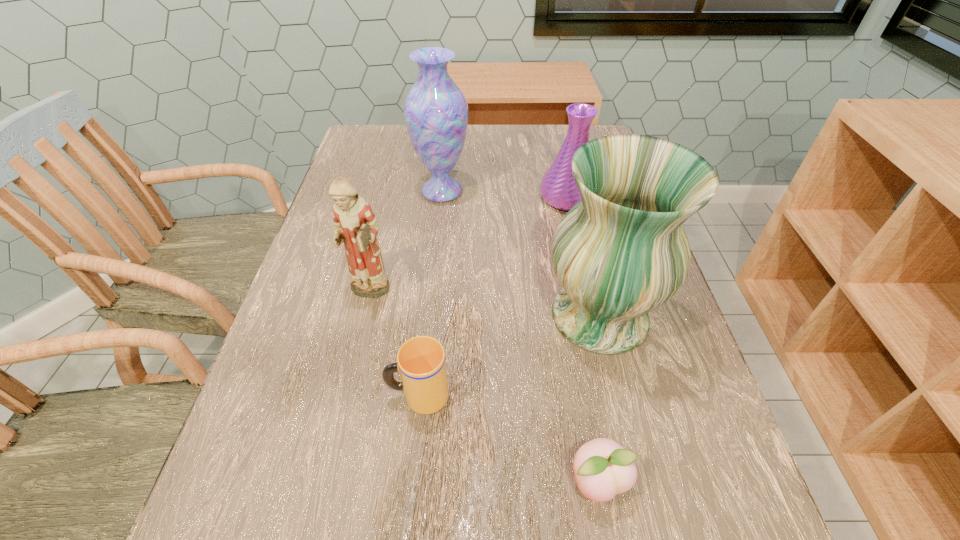
Find the location of `unoccupied area between the nearest vase and the fifth tallest object`. unoccupied area between the nearest vase and the fifth tallest object is located at coordinates (509, 356).

Image resolution: width=960 pixels, height=540 pixels. I want to click on object that stands as the third closest to the fifth farthest object, so click(603, 468).

Where is `object that is the fifth closest to the shortest vase`? This screenshot has height=540, width=960. object that is the fifth closest to the shortest vase is located at coordinates (603, 468).

Locate which vase ranks in proximity to the leftmost vase. Please provide its 2D coordinates. Your answer should be formatted as a tuple, i.e. [(x, y)], where the tuple contains the x and y coordinates of a point satisfying the conditions above.

[(558, 188)]

Locate an element on the screen. vase that is the second nearest to the shortest vase is located at coordinates (621, 252).

At what (x,y) coordinates should I click in order to perform the action: click on free spot that satisfies the following two spatial constraints: 1. on the front-facing side of the figurine; 2. on the side of the second shortest object with the handle. Please return your answer as a coordinate pair (x, y). This screenshot has width=960, height=540. Looking at the image, I should click on (345, 396).

The image size is (960, 540). I want to click on vacant region that satisfies the following two spatial constraints: 1. on the side of the second nearest object with the handle; 2. on the right side of the leftmost vase, so click(441, 191).

Locate an element on the screen. This screenshot has width=960, height=540. free space that satisfies the following two spatial constraints: 1. on the front-facing side of the figurine; 2. on the side of the fifth tallest object with the handle is located at coordinates (345, 396).

Find the location of `free space that satisfies the following two spatial constraints: 1. on the front-facing side of the figurine; 2. on the side of the cup with the handle`. free space that satisfies the following two spatial constraints: 1. on the front-facing side of the figurine; 2. on the side of the cup with the handle is located at coordinates (345, 396).